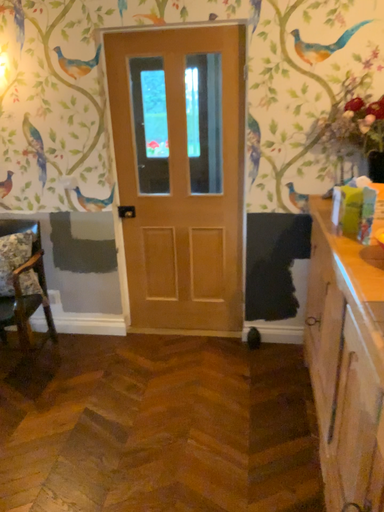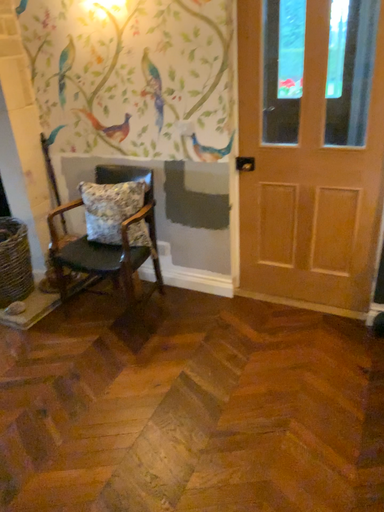
Question: How did the camera likely rotate when shooting the video?

Choices:
 (A) rotated right
 (B) rotated left

Answer: (B)